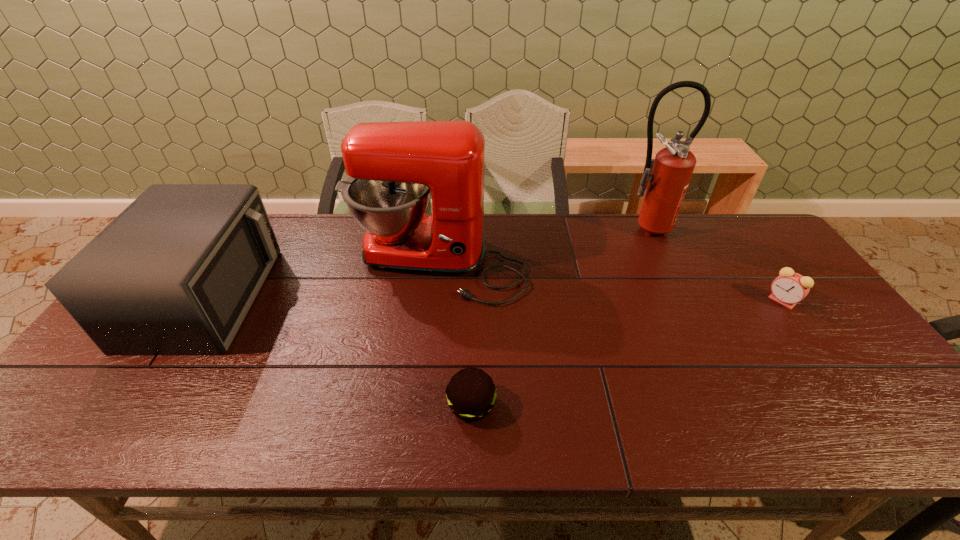
Find the location of `object positioned at the far left corner`. object positioned at the far left corner is located at coordinates (174, 274).

The width and height of the screenshot is (960, 540). In the image, there is a desktop. What are the coordinates of `vacant region at the far edge` in the screenshot? It's located at (522, 238).

At what (x,y) coordinates should I click in order to perform the action: click on vacant region at the near edge of the desktop. Please return your answer as a coordinate pair (x, y). The height and width of the screenshot is (540, 960). Looking at the image, I should click on (168, 430).

This screenshot has height=540, width=960. I want to click on free location at the left edge, so click(x=95, y=373).

Identify the location of vacant area at the near right corner. The height and width of the screenshot is (540, 960). (870, 428).

Locate an element on the screen. Image resolution: width=960 pixels, height=540 pixels. vacant area that lies between the patty and the fourth shortest object is located at coordinates (454, 335).

Identify the location of vacant area that lies between the microwave oven and the rightmost object. (494, 299).

Find the location of a particular element. The width and height of the screenshot is (960, 540). vacant space that's between the nearest object and the kitchen mixer is located at coordinates (454, 335).

Find the location of `vacant space that's between the second tallest object and the nearest object`. vacant space that's between the second tallest object and the nearest object is located at coordinates (454, 335).

The image size is (960, 540). In order to click on vacant space that's between the rightmost object and the fourth shortest object in this screenshot , I will do `click(610, 284)`.